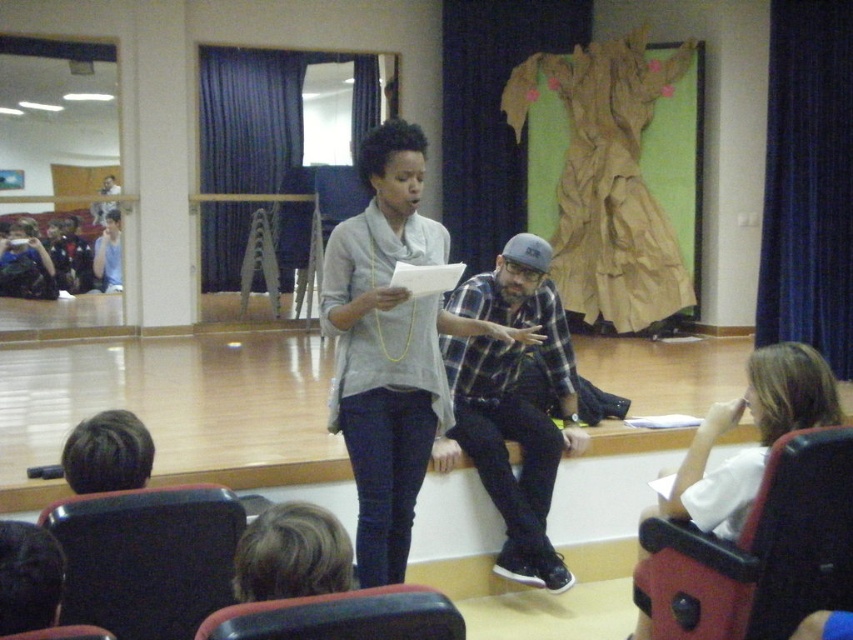
Looking at this image, does flannel shirt at center have a lesser height compared to matte black camera at left?

Incorrect, flannel shirt at center's height does not fall short of matte black camera at left's.

Measure the distance between point (527, 301) and camera.

Point (527, 301) is 3.46 meters from camera.

What do you see at coordinates (512, 403) in the screenshot? The image size is (853, 640). I see `flannel shirt at center` at bounding box center [512, 403].

Find the location of a particular element. flannel shirt at center is located at coordinates (512, 403).

Between point (328, 424) and point (21, 275), which one is positioned in front?

Point (328, 424)

Does gray matte scarf at center have a lesser height compared to matte black camera at left?

In fact, gray matte scarf at center may be taller than matte black camera at left.

Locate an element on the screen. gray matte scarf at center is located at coordinates (386, 348).

Does matte black chair at lower left appear on the left side of smooth black chair at lower left?

Indeed, matte black chair at lower left is positioned on the left side of smooth black chair at lower left.

Can you confirm if matte black chair at lower left is positioned below smooth black chair at lower left?

Yes, matte black chair at lower left is below smooth black chair at lower left.

Which is behind, point (152, 608) or point (86, 625)?

Point (86, 625)

Identify the location of matte black chair at lower left. This screenshot has height=640, width=853. (148, 557).